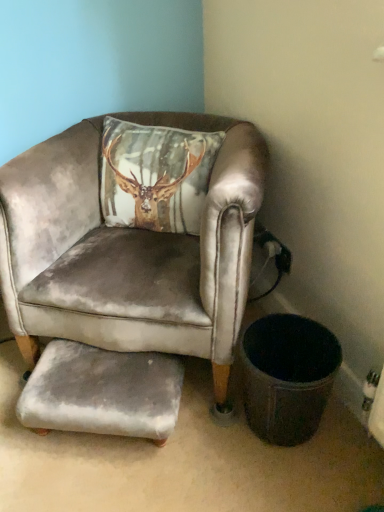
Find the location of a particular element. free space to the right of gray velvety footrest at lower center is located at coordinates (219, 439).